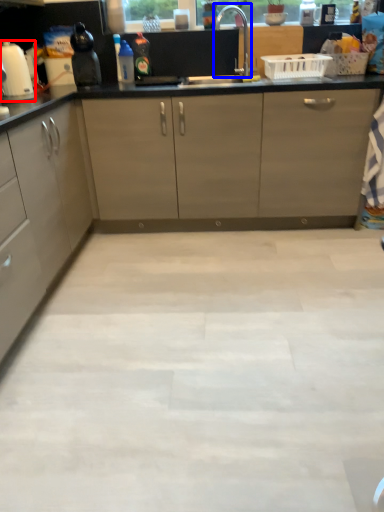
Question: Which object appears farthest to the camera in this image, home appliance (highlighted by a red box) or faucet (highlighted by a blue box)?

Choices:
 (A) home appliance
 (B) faucet

Answer: (B)